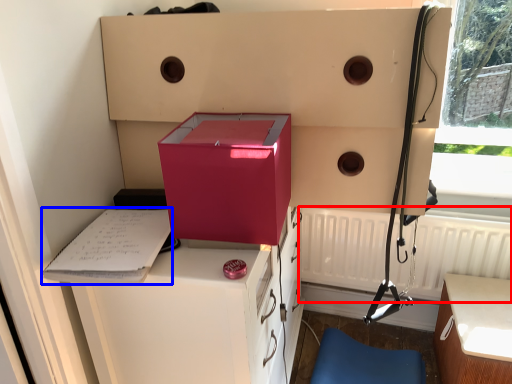
Question: Which point is closer to the camera, radiator (highlighted by a red box) or clipboard (highlighted by a blue box)?

Choices:
 (A) radiator
 (B) clipboard

Answer: (B)